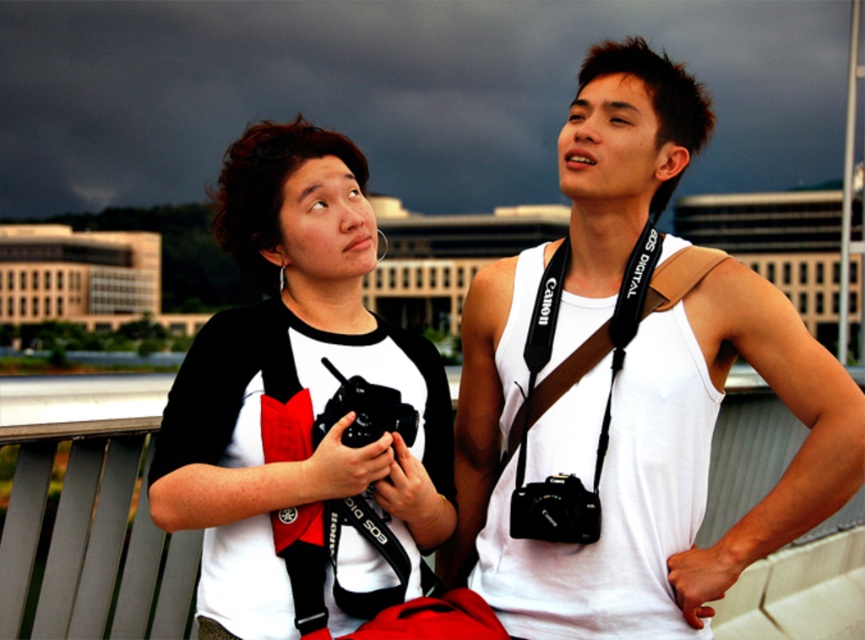
Question: Which object appears farthest from the camera in this image?

Choices:
 (A) black plastic camera at center
 (B) white matte/black raglan shirt at upper left

Answer: (A)

Question: Is white matte/black raglan shirt at upper left wider than black plastic camera at center?

Choices:
 (A) no
 (B) yes

Answer: (B)

Question: Can you confirm if black plastic camera at center is thinner than black rubber camera at center?

Choices:
 (A) no
 (B) yes

Answer: (B)

Question: Does black plastic camera at center come in front of black rubber camera at center?

Choices:
 (A) no
 (B) yes

Answer: (A)

Question: Which point is closer to the camera?

Choices:
 (A) (582, 484)
 (B) (312, 426)

Answer: (B)

Question: Estimate the real-world distances between objects in this image. Which object is closer to the white matte/black raglan shirt at upper left?

Choices:
 (A) black rubber camera at center
 (B) black plastic camera at center

Answer: (A)